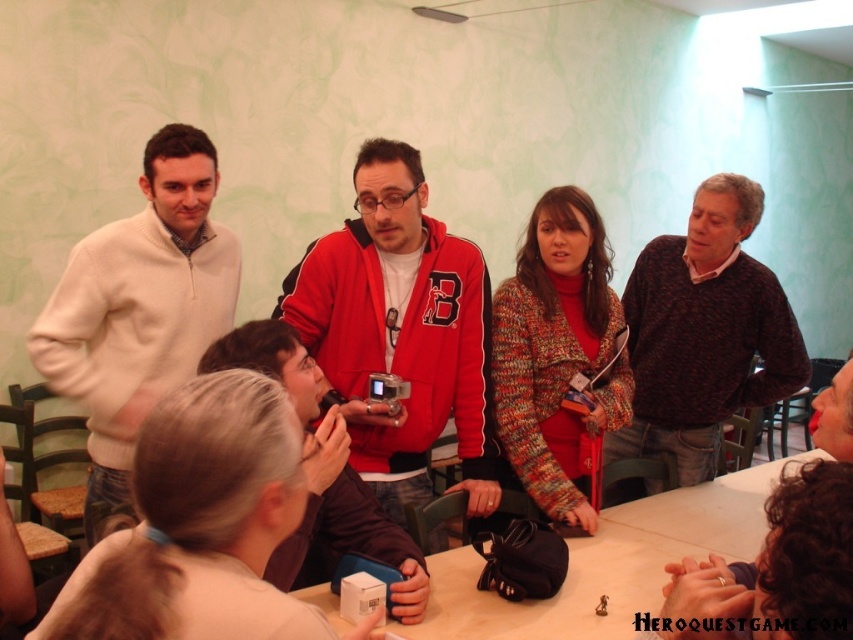
Between dark brown sweater at right and dark brown sweater at center, which one is positioned higher?

dark brown sweater at right is above.

Is dark brown sweater at right shorter than dark brown sweater at center?

No.

Is point (660, 328) positioned after point (706, 586)?

Yes, it is.

The image size is (853, 640). Identify the location of dark brown sweater at right. (704, 332).

Is red fleece jacket at center closer to camera compared to wooden table at center?

No.

Is red fleece jacket at center shorter than wooden table at center?

In fact, red fleece jacket at center may be taller than wooden table at center.

Does point (387, 406) lie behind point (691, 552)?

No, it is not.

The height and width of the screenshot is (640, 853). What are the coordinates of `red fleece jacket at center` in the screenshot? It's located at (399, 332).

Who is higher up, red fleece jacket at center or white fleece sweater at left?

Positioned higher is white fleece sweater at left.

Does red fleece jacket at center have a lesser width compared to white fleece sweater at left?

No, red fleece jacket at center is not thinner than white fleece sweater at left.

Is point (399, 179) positioned behind point (202, 349)?

No.

Find the location of a particular element. This screenshot has width=853, height=640. red fleece jacket at center is located at coordinates (399, 332).